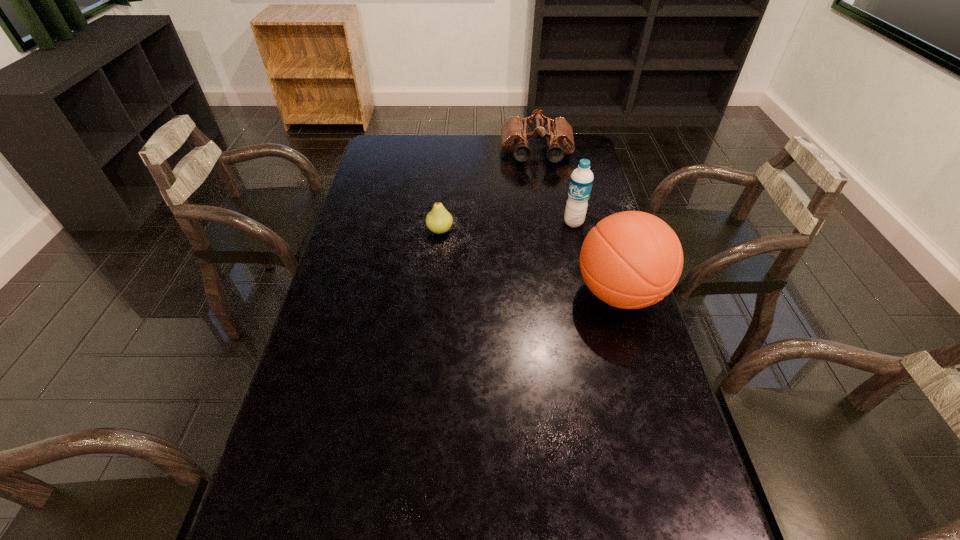
Identify the location of vacant space that satisfies the following two spatial constraints: 1. on the front side of the farthest object; 2. on the left side of the basketball. The height and width of the screenshot is (540, 960). (561, 293).

Where is `free space that satisfies the following two spatial constraints: 1. on the front side of the binoculars; 2. on the left side of the basketball`? free space that satisfies the following two spatial constraints: 1. on the front side of the binoculars; 2. on the left side of the basketball is located at coordinates (561, 293).